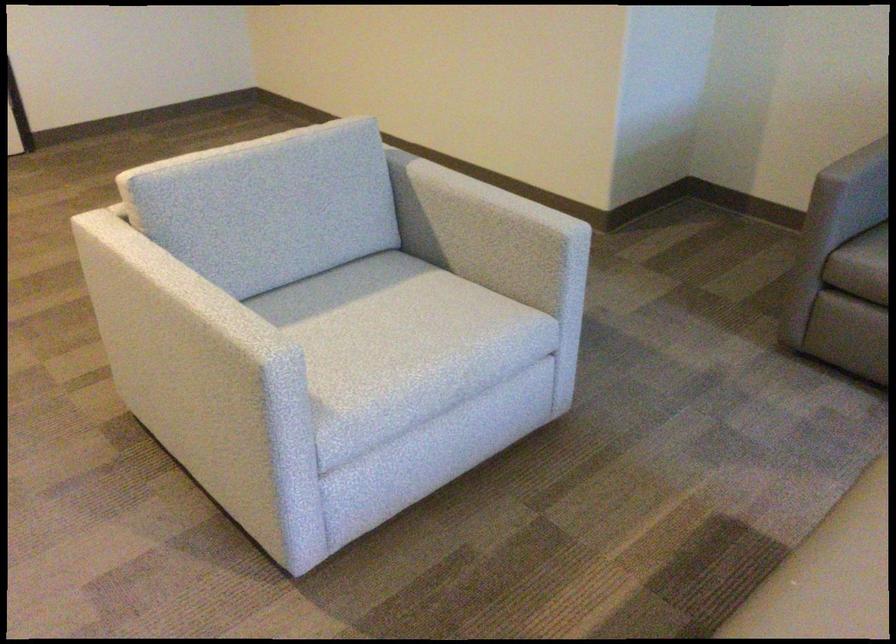
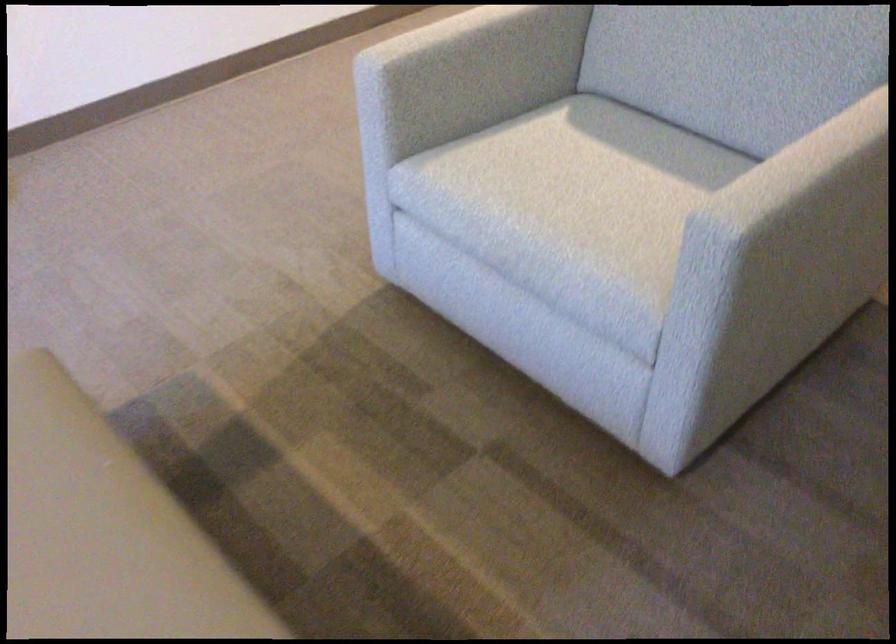
The point at (306, 404) is marked in the first image. Where is the corresponding point in the second image?

(385, 120)